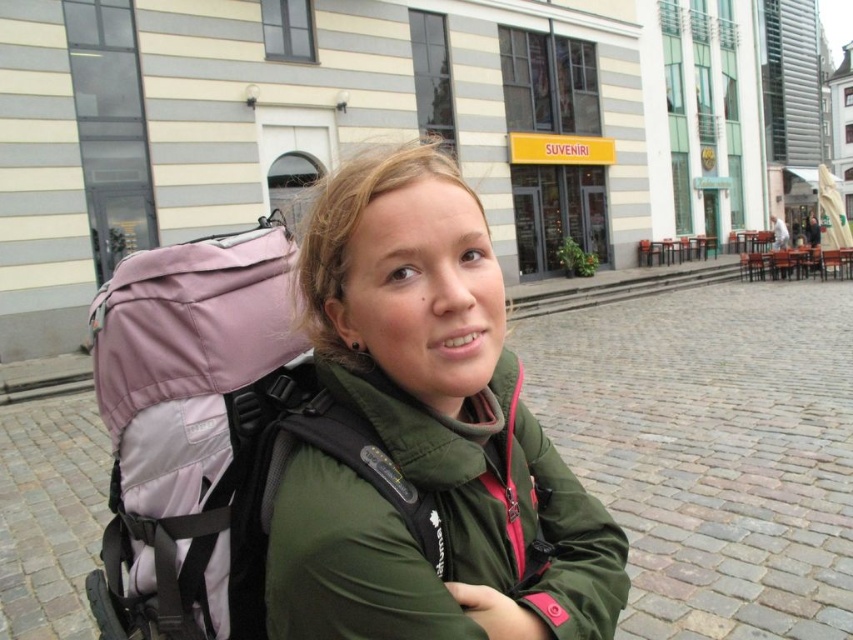
From the picture: Does green matte jacket at center appear under pink fabric backpack at left?

Actually, green matte jacket at center is above pink fabric backpack at left.

Can you confirm if green matte jacket at center is taller than pink fabric backpack at left?

Indeed, green matte jacket at center has a greater height compared to pink fabric backpack at left.

Does point (488, 342) lie behind point (173, 397)?

That is False.

Find the location of `green matte jacket at center`. green matte jacket at center is located at coordinates (428, 435).